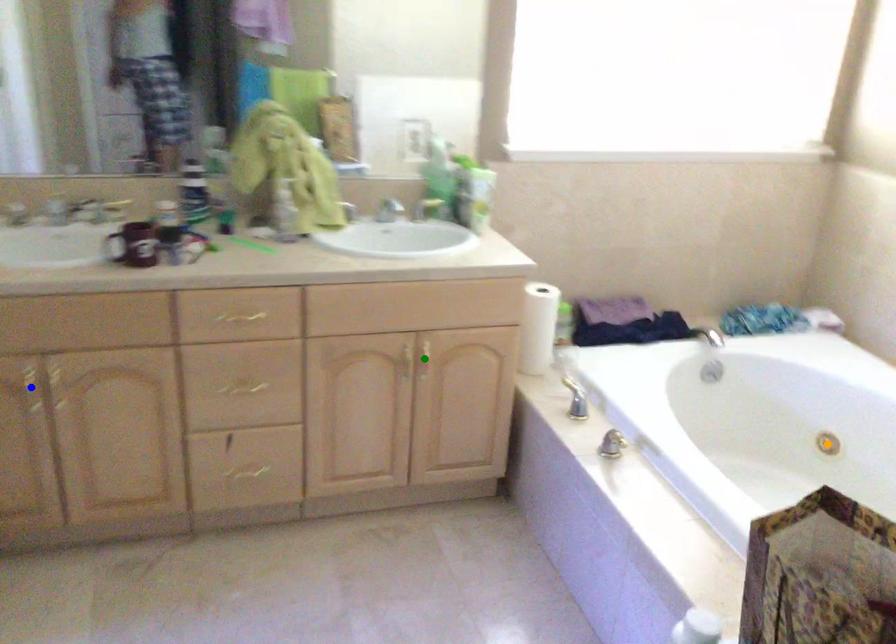
From the picture: Order these from nearest to farthest:
orange point | blue point | green point

orange point → green point → blue point